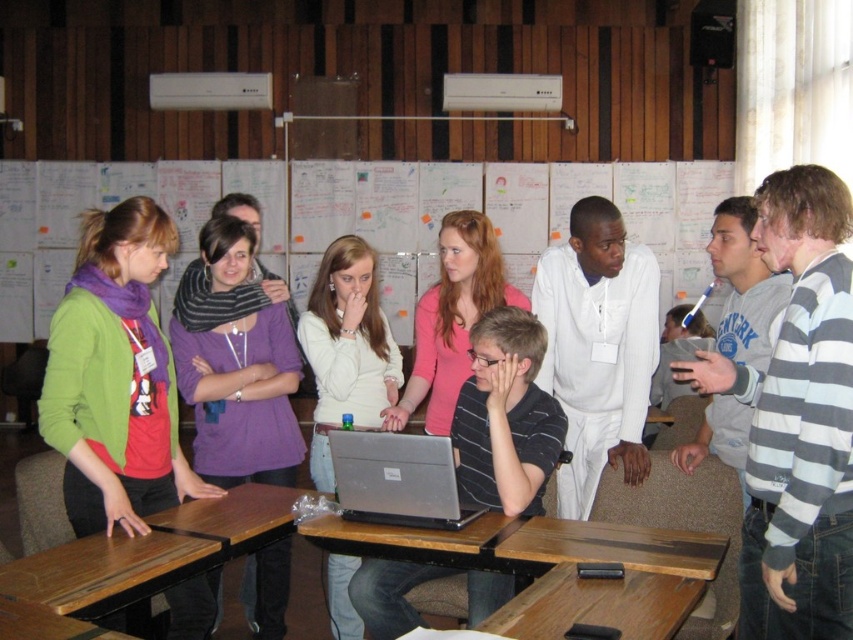
You are a participant in the classroom activity and need to place a small object on the surface closest to you. Which object from the white paperboard at center and wooden table at lower left should you choose?

The wooden table at lower left is closer to you, so you should place the small object on the wooden table at lower left.

You are a photographer trying to capture a candid shot of the group. You notice the gray striped sweater at right and the purple soft scarf at center. Which object should you focus on to ensure the other is also in the frame?

The gray striped sweater at right is above the purple soft scarf at center, so focusing on the gray striped sweater at right will ensure the purple soft scarf at center is also in the frame.